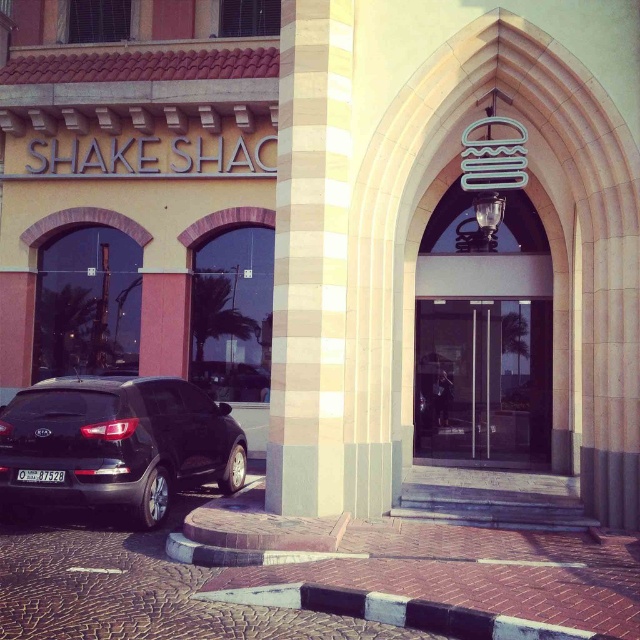
Looking at this image, you are a delivery driver arriving at the Shake Shack restaurant. You need to park your truck, which is the same size as the shiny black suv at lower left. There is a parking spot next to the transparent glass doors at center. Will your truck fit in that parking spot?

The shiny black suv at lower left is bigger than the transparent glass doors at center. Since your truck is the same size as the shiny black suv at lower left, it is likely too large to fit in the parking spot next to the transparent glass doors at center.

You are standing in front of the Shake Shack entrance and notice the beige stone column at center and the shiny black suv at lower left. Which object has a smaller width?

The beige stone column at center is thinner than the shiny black suv at lower left, so the beige stone column at center has a smaller width.